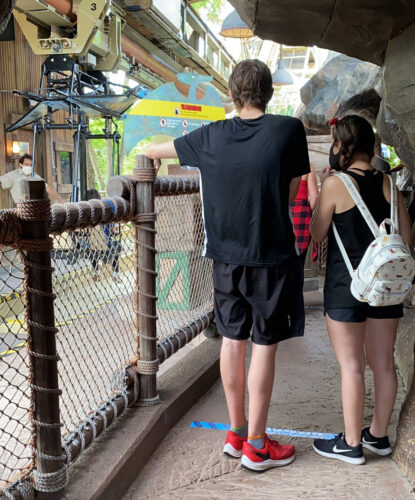
Where is `lights`? Image resolution: width=415 pixels, height=500 pixels. lights is located at coordinates (243, 26).